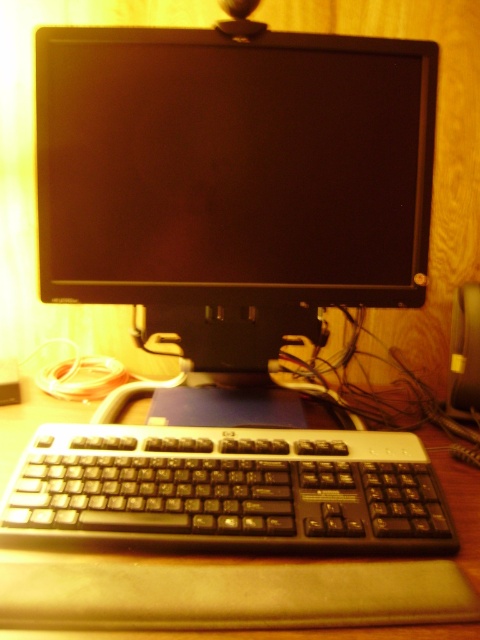
You are organizing a space and need to ensure that the black matte monitor at center doesn not block the view of the brown wooden table at center. Given their heights, which object should be placed higher to maintain visibility?

The black matte monitor at center is already taller than the brown wooden table at center. To maintain visibility, the monitor should be positioned higher so that its height doesn not obstruct the view of the table.

You are setting up a new monitor and want to ensure it will fit on your desk. The current monitor you have is the black plastic keyboard at lower center. The new monitor you want to buy is the black matte monitor at center. Based on their sizes, will the new monitor take up more vertical space on your desk compared to your current one?

The black matte monitor at center has a greater height compared to the black plastic keyboard at lower center, so yes, the new monitor will take up more vertical space on your desk compared to your current one.

You need to place a new monitor that is 20 inches wide on the brown wooden table at center. Based on the current setup, will the black matte monitor at center block the space needed for the new monitor?

The black matte monitor at center has a width less than the brown wooden table at center, so there should be enough space to place the new 20 inch wide monitor without it being blocked by the existing monitor.